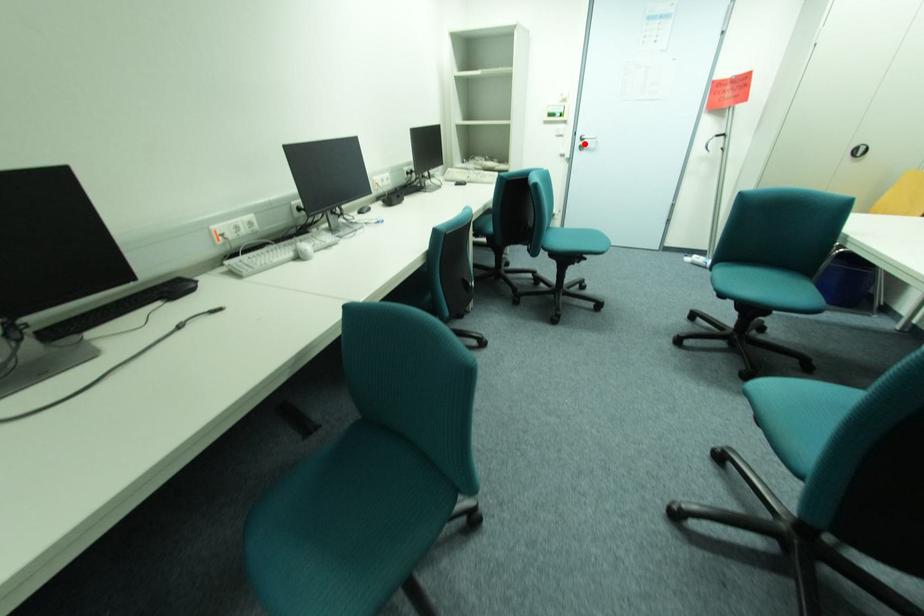
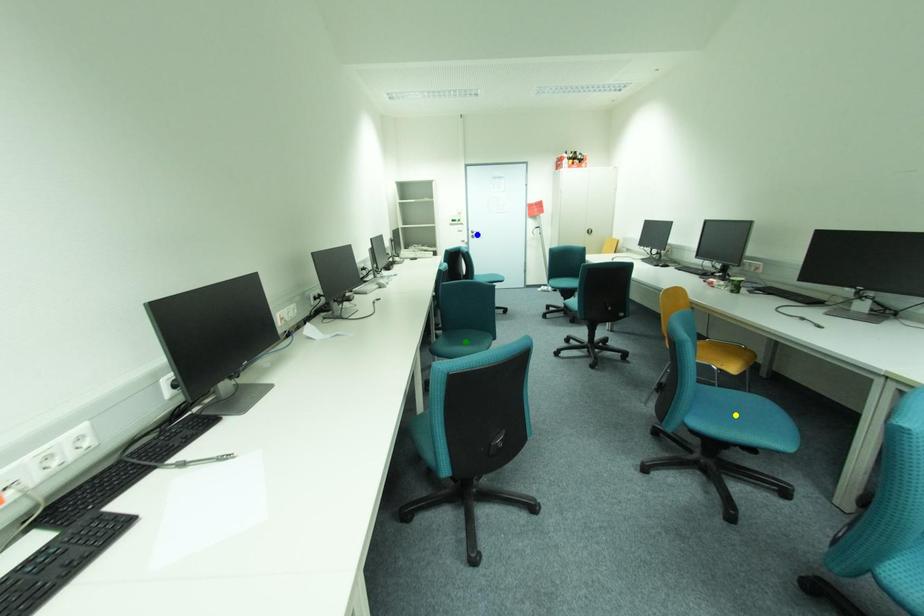
Question: I am providing you with two images of the same scene from different viewpoints. A red point is marked on the first image. You are given multiple points on the second image. Which point in image 2 is actually the same real-world point as the red point in image 1?

Choices:
 (A) green point
 (B) yellow point
 (C) blue point

Answer: (C)